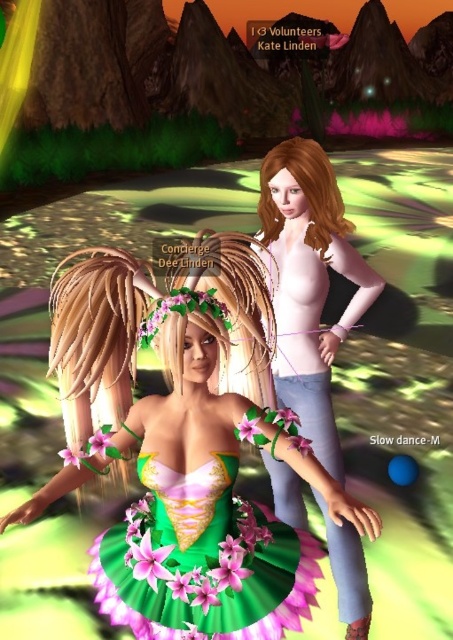
Question: Which of the following is the closest to the observer?

Choices:
 (A) (234, 518)
 (B) (308, 552)

Answer: (A)

Question: Is green floral dress at center smaller than pink matte dress at center?

Choices:
 (A) no
 (B) yes

Answer: (B)

Question: Which point is farther from the camera taking this photo?

Choices:
 (A) (353, 259)
 (B) (231, 588)

Answer: (A)

Question: Is green floral dress at center wider than green satin corset at center?

Choices:
 (A) no
 (B) yes

Answer: (B)

Question: Can you confirm if green satin corset at center is positioned below pink matte dress at center?

Choices:
 (A) no
 (B) yes

Answer: (B)

Question: Which object is the farthest from the pink matte dress at center?

Choices:
 (A) green floral dress at center
 (B) green satin corset at center

Answer: (B)